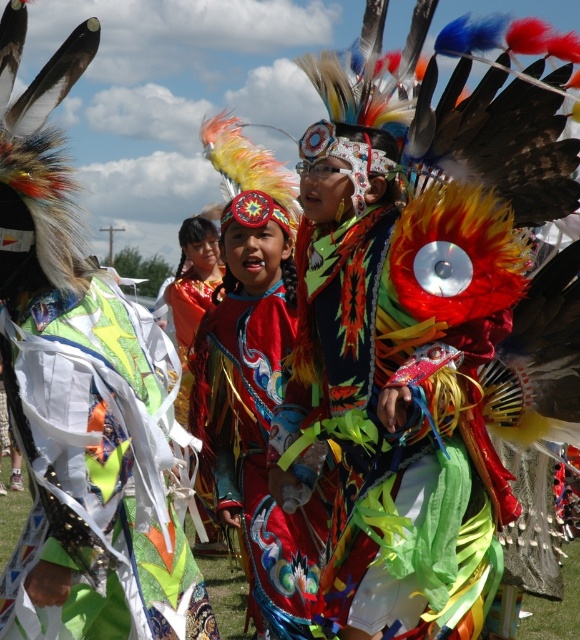
Question: Which of the following is the farthest from the observer?

Choices:
 (A) shiny metallic fabric at center
 (B) shiny silk dress at center

Answer: (B)

Question: Does shiny metallic fabric at center have a smaller size compared to shiny silk dress at center?

Choices:
 (A) no
 (B) yes

Answer: (B)

Question: Is shiny metallic fabric at center in front of shiny silk dress at center?

Choices:
 (A) no
 (B) yes

Answer: (B)

Question: Is shiny metallic fabric at center to the left of shiny silk dress at center from the viewer's perspective?

Choices:
 (A) yes
 (B) no

Answer: (A)